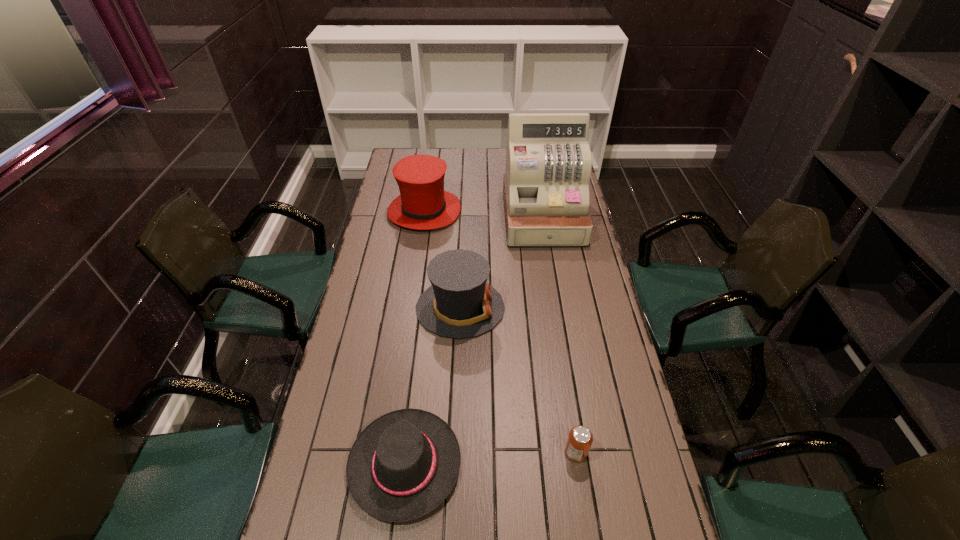
Select which dress hat appears as the closest to the third tallest object. Please provide its 2D coordinates. Your answer should be formatted as a tuple, i.e. [(x, y)], where the tuple contains the x and y coordinates of a point satisfying the conditions above.

[(404, 464)]

Where is `vacant region that satisfies the following two spatial constraints: 1. with goggles on the front of the can; 2. on the right side of the second nearest dress hat`? This screenshot has height=540, width=960. vacant region that satisfies the following two spatial constraints: 1. with goggles on the front of the can; 2. on the right side of the second nearest dress hat is located at coordinates (454, 452).

I want to click on free space that satisfies the following two spatial constraints: 1. on the operating side of the tallest object; 2. with goggles on the front of the third shortest object, so click(558, 308).

Find the location of `vacant region that satisfies the following two spatial constraints: 1. with goggles on the front of the second shortest dress hat; 2. on the right side of the can`. vacant region that satisfies the following two spatial constraints: 1. with goggles on the front of the second shortest dress hat; 2. on the right side of the can is located at coordinates (454, 452).

What are the coordinates of `vacant space that satisfies the following two spatial constraints: 1. with goggles on the front of the second shortest dress hat; 2. on the front side of the nearest dress hat` in the screenshot? It's located at (454, 464).

Where is `free spot that satisfies the following two spatial constraints: 1. with goggles on the front of the third tallest object; 2. on the right side of the can`? free spot that satisfies the following two spatial constraints: 1. with goggles on the front of the third tallest object; 2. on the right side of the can is located at coordinates (454, 452).